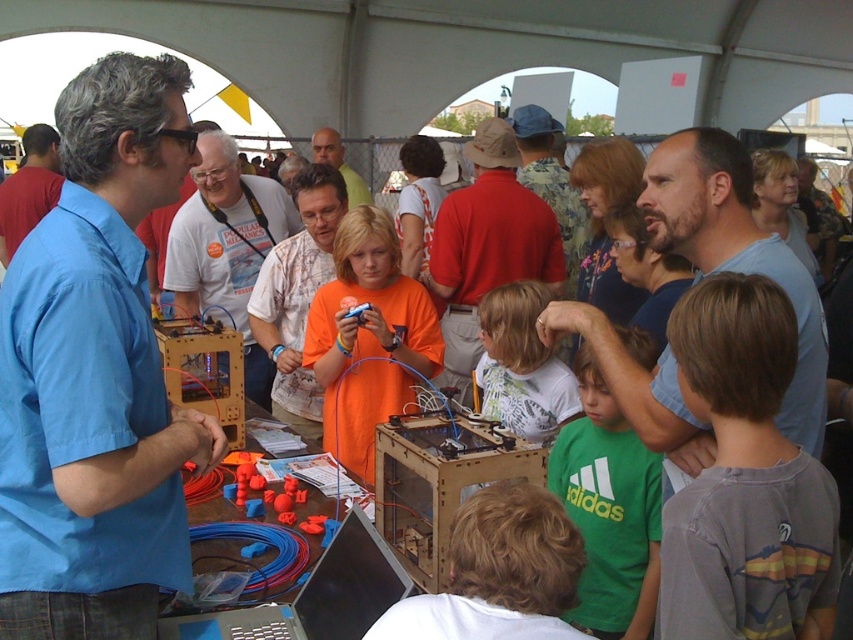
You are a photographer standing in front of the table at the community fair. You want to take a photo of the white shirt at center and the light brown hair at center. Which object should you focus on first to ensure both are in the frame?

You should focus on the white shirt at center first because the light brown hair at center is behind it, so adjusting the frame to include the white shirt will naturally include the light brown hair at center as well.

You are a photographer at the event and want to take a closeup photo of the white shirt at center and light brown hair at center. Which object should you focus on first if you want to capture both in focus without moving the camera?

The white shirt at center is bigger than light brown hair at center, so you should focus on the white shirt at center first to ensure both are in focus.